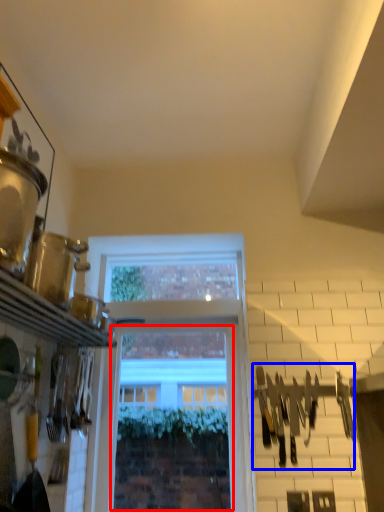
Question: Which object is further to the camera taking this photo, window (highlighted by a red box) or tool (highlighted by a blue box)?

Choices:
 (A) window
 (B) tool

Answer: (A)